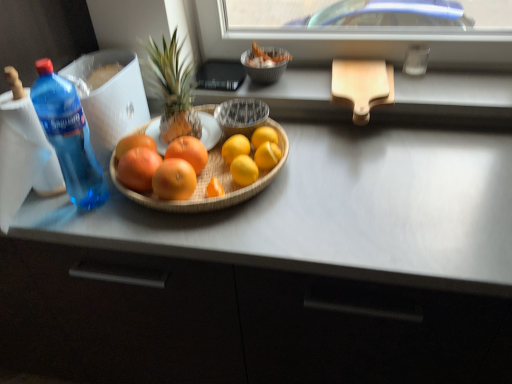
Where is `free space above wooden cutting board at upper right (from a real-world perspective)`? The height and width of the screenshot is (384, 512). free space above wooden cutting board at upper right (from a real-world perspective) is located at coordinates (364, 78).